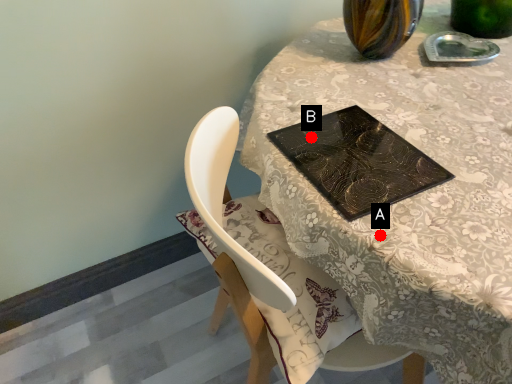
Question: Two points are circled on the image, labeled by A and B beside each circle. Which of the following is the closest to the observer?

Choices:
 (A) A is closer
 (B) B is closer

Answer: (A)